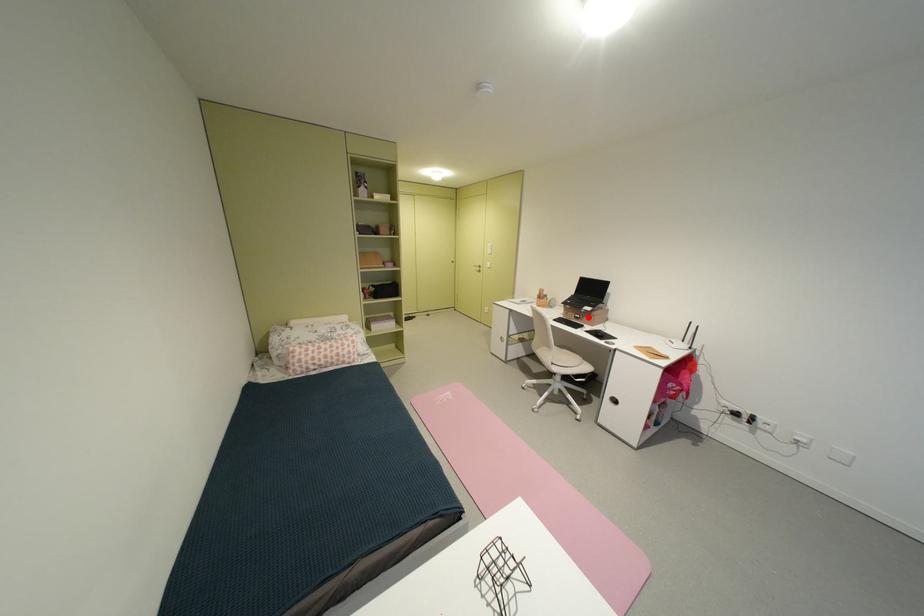
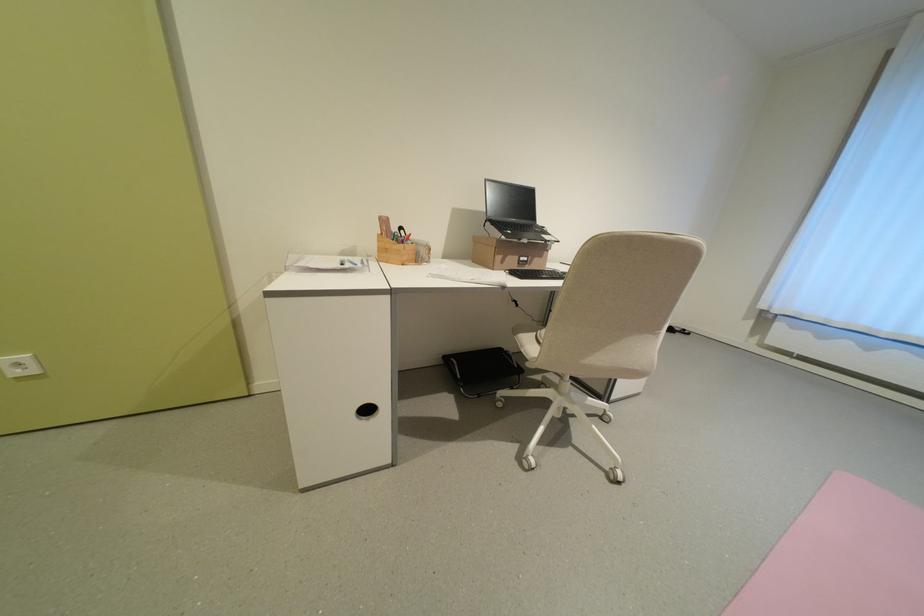
Find the pixel in the second image that matches the highlighted location in the first image.

(536, 261)